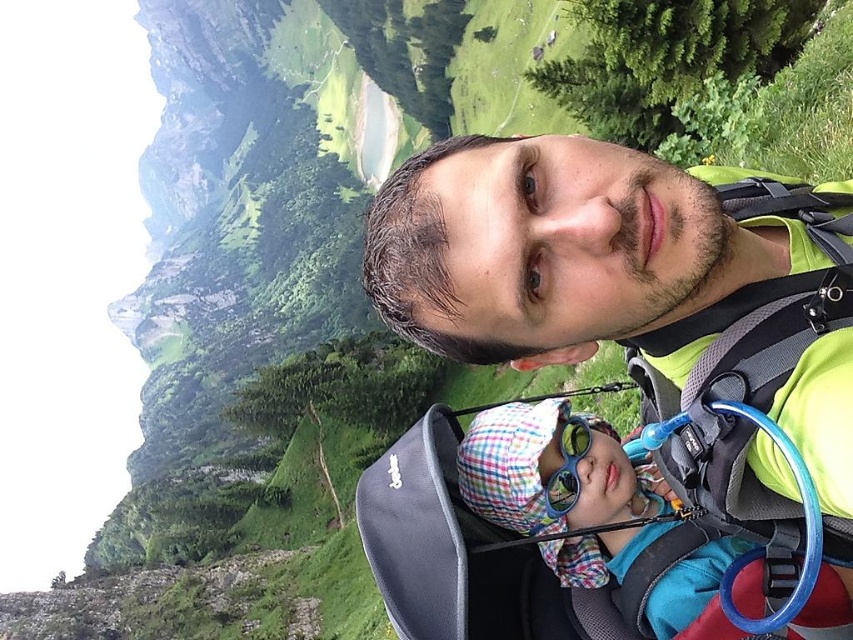
This screenshot has width=853, height=640. What do you see at coordinates (622, 272) in the screenshot? I see `matte green shirt at upper center` at bounding box center [622, 272].

Does matte green shirt at upper center have a greater height compared to plaid fabric hat at lower center?

Indeed, matte green shirt at upper center has a greater height compared to plaid fabric hat at lower center.

Is point (703, 202) positioned after point (706, 600)?

No.

At what (x,y) coordinates should I click in order to perform the action: click on matte green shirt at upper center. Please return your answer as a coordinate pair (x, y). The width and height of the screenshot is (853, 640). Looking at the image, I should click on (622, 272).